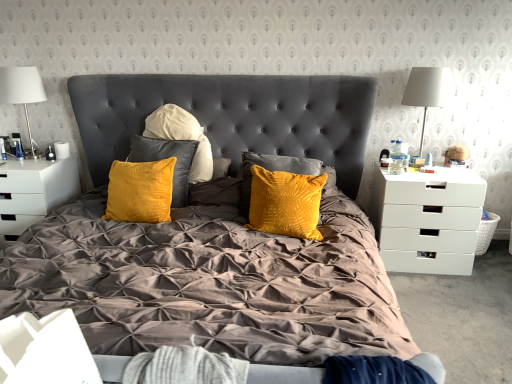
Question: Considering the positions of velvet yellow pillow at center and clear plastic bottle at right side in the image, is velvet yellow pillow at center wider or thinner than clear plastic bottle at right side?

Choices:
 (A) wide
 (B) thin

Answer: (A)

Question: From their relative heights in the image, would you say velvet yellow pillow at center is taller or shorter than clear plastic bottle at right side?

Choices:
 (A) short
 (B) tall

Answer: (B)

Question: Which object is positioned closest to the white wicker picnic basket at right?

Choices:
 (A) matte white coffee cup at left
 (B) white matte drawer at right, acting as the 2th nightstand starting from the left
 (C) white glossy nightstand at left, the 2th nightstand positioned from the right
 (D) white fabric lampshade at right, positioned as the 2th lamp in left-to-right order
 (E) velvet yellow pillow at center

Answer: (B)

Question: Estimate the real-world distances between objects in this image. Which object is closer to the white fabric at lower left?

Choices:
 (A) white fabric lampshade at left, which is counted as the first lamp, starting from the left
 (B) white fabric lampshade at right, the first lamp positioned from the right
 (C) white matte drawer at right, acting as the 2th nightstand starting from the left
 (D) velvet yellow pillow at center
 (E) clear plastic bottle at right side

Answer: (D)